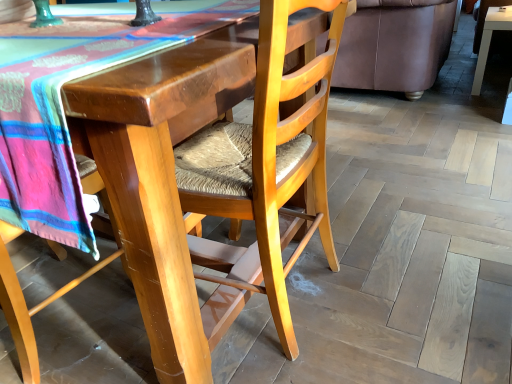
Find the location of a particular element. Image resolution: width=512 pixels, height=384 pixels. brown leather couch at upper right is located at coordinates (395, 45).

Is brown leather couch at upper right facing towards wooden woven seat at center, arranged as the first chair when viewed from the left?

No, brown leather couch at upper right is not aimed at wooden woven seat at center, arranged as the first chair when viewed from the left.

Who is taller, brown leather couch at upper right or wooden woven seat at center, arranged as the first chair when viewed from the left?

With more height is wooden woven seat at center, arranged as the first chair when viewed from the left.

Does brown leather couch at upper right touch wooden woven seat at center, arranged as the 2th chair when viewed from the right?

No, brown leather couch at upper right is not beside wooden woven seat at center, arranged as the 2th chair when viewed from the right.

Does brown leather couch at upper right have a larger size compared to wooden woven seat at center, arranged as the 2th chair when viewed from the right?

No.

Considering the sizes of objects wooden woven seat at center, arranged as the first chair when viewed from the left, and white glossy table at upper right in the image provided, who is wider, wooden woven seat at center, arranged as the first chair when viewed from the left, or white glossy table at upper right?

With larger width is wooden woven seat at center, arranged as the first chair when viewed from the left.

From the image's perspective, would you say wooden woven seat at center, arranged as the first chair when viewed from the left, is shown under white glossy table at upper right?

Yes, from the image's perspective, wooden woven seat at center, arranged as the first chair when viewed from the left, is beneath white glossy table at upper right.

Is wooden woven seat at center, arranged as the first chair when viewed from the left, taller than white glossy table at upper right?

Correct, wooden woven seat at center, arranged as the first chair when viewed from the left, is much taller as white glossy table at upper right.

Does point (475, 95) lie behind point (393, 1)?

Yes, point (475, 95) is behind point (393, 1).

Can you confirm if white glossy table at upper right is wider than brown leather couch at upper right?

No.

Is white glossy table at upper right not close to brown leather couch at upper right?

No.

How many degrees apart are the facing directions of white glossy table at upper right and brown leather couch at upper right?

The facing directions of white glossy table at upper right and brown leather couch at upper right are 179 degrees apart.

Does wooden woven seat at lower left, which appears as the first chair when viewed from the right, have a smaller size compared to wooden woven seat at center, arranged as the first chair when viewed from the left?

Correct, wooden woven seat at lower left, which appears as the first chair when viewed from the right, occupies less space than wooden woven seat at center, arranged as the first chair when viewed from the left.

Is wooden woven seat at lower left, which ranks as the second chair in left-to-right order, located outside wooden woven seat at center, arranged as the first chair when viewed from the left?

No, wooden woven seat at lower left, which ranks as the second chair in left-to-right order, is not outside of wooden woven seat at center, arranged as the first chair when viewed from the left.

Considering the points (87, 194) and (141, 166), which point is in front, point (87, 194) or point (141, 166)?

The point (141, 166) is more forward.

Which is more distant, (478, 85) or (137, 156)?

The point (478, 85) is farther from the camera.

Consider the image. From a real-world perspective, is white glossy table at upper right physically located above or below wooden woven seat at center, arranged as the first chair when viewed from the left?

From a real-world perspective, white glossy table at upper right is physically below wooden woven seat at center, arranged as the first chair when viewed from the left.

In the scene shown: Are white glossy table at upper right and wooden woven seat at center, arranged as the first chair when viewed from the left, far apart?

Yes, white glossy table at upper right and wooden woven seat at center, arranged as the first chair when viewed from the left, are quite far apart.

Does wooden woven seat at center, arranged as the 2th chair when viewed from the right, have a lesser width compared to wooden woven seat at lower left, which appears as the first chair when viewed from the right?

Incorrect, the width of wooden woven seat at center, arranged as the 2th chair when viewed from the right, is not less than that of wooden woven seat at lower left, which appears as the first chair when viewed from the right.

Does wooden woven seat at center, arranged as the 2th chair when viewed from the right, turn towards wooden woven seat at lower left, which ranks as the second chair in left-to-right order?

Yes, wooden woven seat at center, arranged as the 2th chair when viewed from the right, is turned towards wooden woven seat at lower left, which ranks as the second chair in left-to-right order.

Which is nearer, (x=192, y=381) or (x=7, y=300)?

Point (x=192, y=381).

From their relative heights in the image, would you say wooden woven seat at center, arranged as the 2th chair when viewed from the right, is taller or shorter than wooden woven seat at lower left, which ranks as the second chair in left-to-right order?

wooden woven seat at center, arranged as the 2th chair when viewed from the right, is shorter than wooden woven seat at lower left, which ranks as the second chair in left-to-right order.

How many degrees apart are the facing directions of wooden woven seat at lower left, which appears as the first chair when viewed from the right, and white glossy table at upper right?

The facing directions of wooden woven seat at lower left, which appears as the first chair when viewed from the right, and white glossy table at upper right are 178 degrees apart.

From the image's perspective, is wooden woven seat at lower left, which appears as the first chair when viewed from the right, positioned above or below white glossy table at upper right?

From the image's perspective, wooden woven seat at lower left, which appears as the first chair when viewed from the right, appears below white glossy table at upper right.

At what (x,y) coordinates should I click in order to perform the action: click on table on the right of the wooden woven seat at lower left, which ranks as the second chair in left-to-right order. Please return your answer as a coordinate pair (x, y). The height and width of the screenshot is (384, 512). Looking at the image, I should click on (490, 40).

Could white glossy table at upper right be considered to be inside wooden woven seat at lower left, which appears as the first chair when viewed from the right?

Definitely not — white glossy table at upper right is not inside wooden woven seat at lower left, which appears as the first chair when viewed from the right.

From a real-world perspective, which chair is the 1st one above the brown leather couch at upper right? Please provide its 2D coordinates.

[(159, 195)]

You are a GUI agent. You are given a task and a screenshot of the screen. Output one action in this format:
    pyautogui.click(x=<x>, y=<y>)
    Task: Click on the table below the wooden woven seat at center, arranged as the first chair when viewed from the left (from a real-world perspective)
    
    Given the screenshot: What is the action you would take?
    pyautogui.click(x=490, y=40)

From the image, which object appears to be farther from wooden woven seat at lower left, which ranks as the second chair in left-to-right order, wooden woven seat at center, arranged as the first chair when viewed from the left, or brown leather couch at upper right?

Among the two, brown leather couch at upper right is located further to wooden woven seat at lower left, which ranks as the second chair in left-to-right order.

Estimate the real-world distances between objects in this image. Which object is closer to wooden woven seat at lower left, which ranks as the second chair in left-to-right order, white glossy table at upper right or wooden woven seat at center, arranged as the first chair when viewed from the left?

Based on the image, wooden woven seat at center, arranged as the first chair when viewed from the left, appears to be nearer to wooden woven seat at lower left, which ranks as the second chair in left-to-right order.

Estimate the real-world distances between objects in this image. Which object is closer to wooden woven seat at lower left, which appears as the first chair when viewed from the right, brown leather couch at upper right or wooden woven seat at center, arranged as the 2th chair when viewed from the right?

wooden woven seat at center, arranged as the 2th chair when viewed from the right.

Considering their positions, is wooden woven seat at center, arranged as the first chair when viewed from the left, positioned closer to brown leather couch at upper right than wooden woven seat at lower left, which ranks as the second chair in left-to-right order?

The object closer to brown leather couch at upper right is wooden woven seat at lower left, which ranks as the second chair in left-to-right order.

Looking at the image, which one is located closer to wooden woven seat at center, arranged as the 2th chair when viewed from the right, wooden woven seat at lower left, which appears as the first chair when viewed from the right, or white glossy table at upper right?

Based on the image, wooden woven seat at lower left, which appears as the first chair when viewed from the right, appears to be nearer to wooden woven seat at center, arranged as the 2th chair when viewed from the right.

Which object lies further to the anchor point white glossy table at upper right, wooden woven seat at center, arranged as the 2th chair when viewed from the right, or brown leather couch at upper right?

The object further to white glossy table at upper right is wooden woven seat at center, arranged as the 2th chair when viewed from the right.

From the image, which object appears to be farther from wooden woven seat at lower left, which ranks as the second chair in left-to-right order, white glossy table at upper right or brown leather couch at upper right?

white glossy table at upper right lies further to wooden woven seat at lower left, which ranks as the second chair in left-to-right order, than the other object.

Based on their spatial positions, is wooden woven seat at center, arranged as the first chair when viewed from the left, or white glossy table at upper right closer to brown leather couch at upper right?

Based on the image, white glossy table at upper right appears to be nearer to brown leather couch at upper right.

Find the location of `couch situated between wooden woven seat at center, arranged as the first chair when viewed from the left, and white glossy table at upper right from left to right`. couch situated between wooden woven seat at center, arranged as the first chair when viewed from the left, and white glossy table at upper right from left to right is located at coordinates [x=395, y=45].

Find the location of a particular element. Image resolution: width=512 pixels, height=384 pixels. chair between wooden woven seat at center, arranged as the 2th chair when viewed from the right, and white glossy table at upper right from left to right is located at coordinates (26, 306).

The image size is (512, 384). What are the coordinates of `couch between wooden woven seat at lower left, which appears as the first chair when viewed from the right, and white glossy table at upper right` in the screenshot? It's located at (395, 45).

Identify the location of chair between wooden woven seat at center, arranged as the 2th chair when viewed from the right, and brown leather couch at upper right in the front-back direction. Image resolution: width=512 pixels, height=384 pixels. (26, 306).